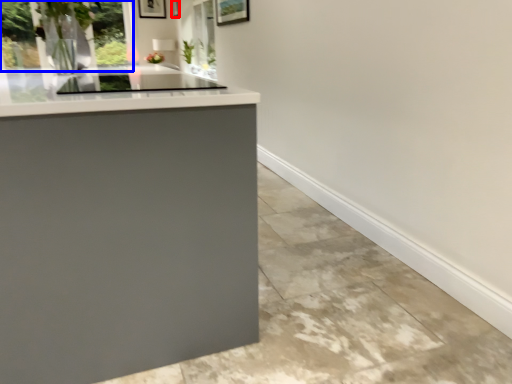
Question: Which of the following is the farthest to the observer, picture frame (highlighted by a red box) or window (highlighted by a blue box)?

Choices:
 (A) picture frame
 (B) window

Answer: (A)